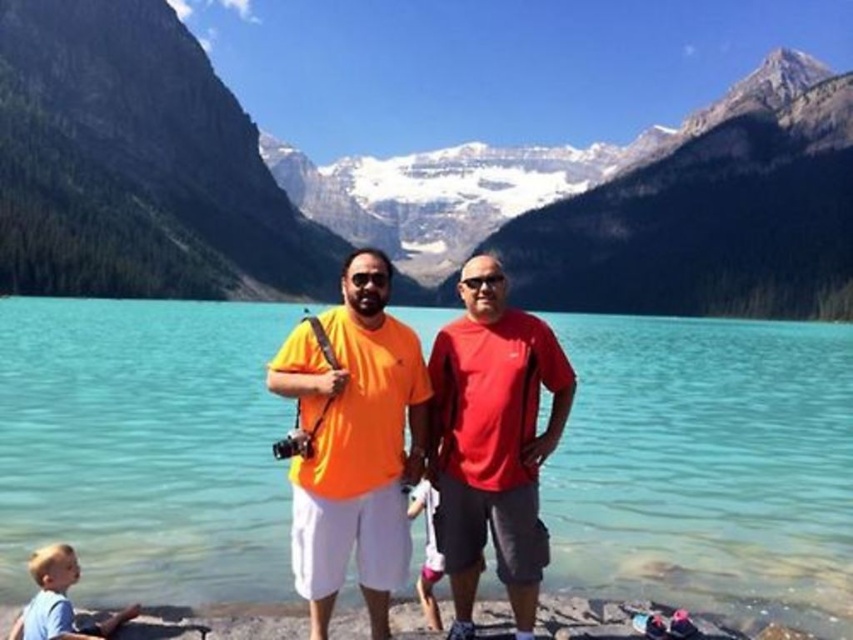
You are a photographer trying to capture the best shot of the clear blue water at center. Based on its position coordinates, where should you aim your camera?

The clear blue water at center is located at coordinates point [706,467], so aim your camera at that point to capture it best.

You are a photographer standing at the camera position. You want to place a small flag at the closest point between point (x=788, y=608) and point (x=749, y=248). Which point should you choose?

Point (x=788, y=608) is closer to the camera than point (x=749, y=248), so you should choose point (x=788, y=608) to place the flag.